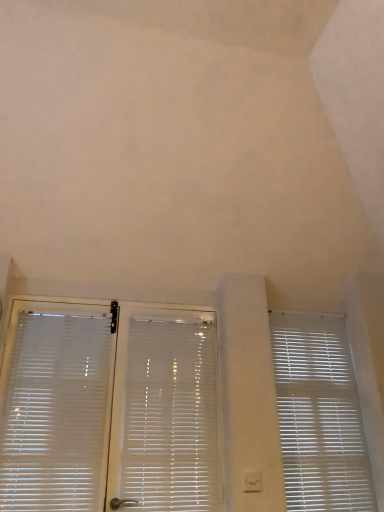
The width and height of the screenshot is (384, 512). Describe the element at coordinates (56, 407) in the screenshot. I see `white translucent blinds at left, placed as the 3th window blind when sorted from right to left` at that location.

What is the approximate height of white translucent blinds at left, placed as the 3th window blind when sorted from right to left?

white translucent blinds at left, placed as the 3th window blind when sorted from right to left, is 99.46 centimeters in height.

You are a GUI agent. You are given a task and a screenshot of the screen. Output one action in this format:
    pyautogui.click(x=<x>, y=<y>)
    Task: Click on the white plastic blinds at center, which appears as the second window blind when viewed from the left
    
    Given the screenshot: What is the action you would take?
    pyautogui.click(x=171, y=417)

Where is `white translucent blinds at left, placed as the 3th window blind when sorted from right to left`? The image size is (384, 512). white translucent blinds at left, placed as the 3th window blind when sorted from right to left is located at coordinates (56, 407).

Considering the positions of objects white plastic blinds at center, which appears as the second window blind when viewed from the left, and white plastic window blind at right, the first window blind from the right, in the image provided, who is more to the left, white plastic blinds at center, which appears as the second window blind when viewed from the left, or white plastic window blind at right, the first window blind from the right,?

white plastic blinds at center, which appears as the second window blind when viewed from the left, is more to the left.

How distant is white plastic blinds at center, which is the second window blind in right-to-left order, from white plastic window blind at right, the third window blind in the left-to-right sequence?

white plastic blinds at center, which is the second window blind in right-to-left order, is 24.55 inches away from white plastic window blind at right, the third window blind in the left-to-right sequence.

From the picture: How different are the orientations of white plastic blinds at center, which is the second window blind in right-to-left order, and white plastic window blind at right, the third window blind in the left-to-right sequence, in degrees?

white plastic blinds at center, which is the second window blind in right-to-left order, and white plastic window blind at right, the third window blind in the left-to-right sequence, are facing 1.87 degrees away from each other.

Does point (163, 426) lie in front of point (74, 317)?

Yes.

From the image's perspective, is white plastic blinds at center, which is the second window blind in right-to-left order, positioned above or below white translucent blinds at left, placed as the 3th window blind when sorted from right to left?

white plastic blinds at center, which is the second window blind in right-to-left order, is below white translucent blinds at left, placed as the 3th window blind when sorted from right to left.

Is white plastic blinds at center, which is the second window blind in right-to-left order, positioned far away from white translucent blinds at left, placed as the 1th window blind when sorted from left to right?

white plastic blinds at center, which is the second window blind in right-to-left order, is near white translucent blinds at left, placed as the 1th window blind when sorted from left to right, not far away.

Is white plastic blinds at center, which appears as the second window blind when viewed from the left, inside or outside of white translucent blinds at left, placed as the 3th window blind when sorted from right to left?

white plastic blinds at center, which appears as the second window blind when viewed from the left, is located beyond the bounds of white translucent blinds at left, placed as the 3th window blind when sorted from right to left.

Which point is more forward, (294, 331) or (158, 368)?

The point (158, 368) is closer to the camera.

Is white plastic window blind at right, the first window blind from the right, beside white plastic blinds at center, which appears as the second window blind when viewed from the left?

They are not placed beside each other.

Is white plastic window blind at right, the third window blind in the left-to-right sequence, at the left side of white plastic blinds at center, which is the second window blind in right-to-left order?

No.

Does white plastic window blind at right, the first window blind from the right, have a lesser width compared to white plastic blinds at center, which appears as the second window blind when viewed from the left?

Correct, the width of white plastic window blind at right, the first window blind from the right, is less than that of white plastic blinds at center, which appears as the second window blind when viewed from the left.

From a real-world perspective, is white plastic window blind at right, the third window blind in the left-to-right sequence, located beneath white translucent blinds at left, placed as the 3th window blind when sorted from right to left?

Actually, white plastic window blind at right, the third window blind in the left-to-right sequence, is physically above white translucent blinds at left, placed as the 3th window blind when sorted from right to left, in the real world.

Consider the image. Is white plastic window blind at right, the first window blind from the right, positioned beyond the bounds of white translucent blinds at left, placed as the 3th window blind when sorted from right to left?

Indeed, white plastic window blind at right, the first window blind from the right, is completely outside white translucent blinds at left, placed as the 3th window blind when sorted from right to left.

From the image's perspective, which one is positioned higher, white plastic window blind at right, the first window blind from the right, or white translucent blinds at left, placed as the 1th window blind when sorted from left to right?

white translucent blinds at left, placed as the 1th window blind when sorted from left to right.

Is white translucent blinds at left, placed as the 3th window blind when sorted from right to left, spatially inside white plastic blinds at center, which appears as the second window blind when viewed from the left, or outside of it?

white translucent blinds at left, placed as the 3th window blind when sorted from right to left, exists outside the volume of white plastic blinds at center, which appears as the second window blind when viewed from the left.

From a real-world perspective, between white translucent blinds at left, placed as the 1th window blind when sorted from left to right, and white plastic blinds at center, which appears as the second window blind when viewed from the left, who is vertically lower?

From a 3D spatial view, white plastic blinds at center, which appears as the second window blind when viewed from the left, is below.

How many degrees apart are the facing directions of white translucent blinds at left, placed as the 1th window blind when sorted from left to right, and white plastic blinds at center, which appears as the second window blind when viewed from the left?

0.00102 degrees.

Does white translucent blinds at left, placed as the 1th window blind when sorted from left to right, come behind white plastic blinds at center, which appears as the second window blind when viewed from the left?

No, it is not.

Choose the correct answer: Is white translucent blinds at left, placed as the 1th window blind when sorted from left to right, inside white plastic window blind at right, the third window blind in the left-to-right sequence, or outside it?

white translucent blinds at left, placed as the 1th window blind when sorted from left to right, cannot be found inside white plastic window blind at right, the third window blind in the left-to-right sequence.

Based on the photo, from the image's perspective, does white translucent blinds at left, placed as the 3th window blind when sorted from right to left, appear lower than white plastic window blind at right, the first window blind from the right?

Actually, white translucent blinds at left, placed as the 3th window blind when sorted from right to left, appears above white plastic window blind at right, the first window blind from the right, in the image.

Is white translucent blinds at left, placed as the 3th window blind when sorted from right to left, with white plastic window blind at right, the third window blind in the left-to-right sequence?

white translucent blinds at left, placed as the 3th window blind when sorted from right to left, and white plastic window blind at right, the third window blind in the left-to-right sequence, are clearly separated.

Where is `window blind on the right of white plastic blinds at center, which is the second window blind in right-to-left order`? This screenshot has height=512, width=384. window blind on the right of white plastic blinds at center, which is the second window blind in right-to-left order is located at coordinates (319, 415).

Which window blind is the 1st one when counting from the back of the white translucent blinds at left, placed as the 3th window blind when sorted from right to left? Please provide its 2D coordinates.

[(171, 417)]

Which object lies nearer to the anchor point white translucent blinds at left, placed as the 3th window blind when sorted from right to left, white plastic window blind at right, the first window blind from the right, or white plastic blinds at center, which is the second window blind in right-to-left order?

Based on the image, white plastic blinds at center, which is the second window blind in right-to-left order, appears to be nearer to white translucent blinds at left, placed as the 3th window blind when sorted from right to left.

Estimate the real-world distances between objects in this image. Which object is further from white plastic window blind at right, the first window blind from the right, white translucent blinds at left, placed as the 1th window blind when sorted from left to right, or white plastic blinds at center, which is the second window blind in right-to-left order?

Among the two, white translucent blinds at left, placed as the 1th window blind when sorted from left to right, is located further to white plastic window blind at right, the first window blind from the right.

In the scene shown: Based on their spatial positions, is white plastic blinds at center, which appears as the second window blind when viewed from the left, or white translucent blinds at left, placed as the 3th window blind when sorted from right to left, closer to white plastic window blind at right, the first window blind from the right?

white plastic blinds at center, which appears as the second window blind when viewed from the left, lies closer to white plastic window blind at right, the first window blind from the right, than the other object.

When comparing their distances from white plastic blinds at center, which appears as the second window blind when viewed from the left, does white translucent blinds at left, placed as the 1th window blind when sorted from left to right, or white plastic window blind at right, the first window blind from the right, seem further?

white plastic window blind at right, the first window blind from the right, is positioned further to the anchor white plastic blinds at center, which appears as the second window blind when viewed from the left.

Estimate the real-world distances between objects in this image. Which object is closer to white plastic blinds at center, which appears as the second window blind when viewed from the left, white plastic window blind at right, the first window blind from the right, or white translucent blinds at left, placed as the 3th window blind when sorted from right to left?

white translucent blinds at left, placed as the 3th window blind when sorted from right to left, lies closer to white plastic blinds at center, which appears as the second window blind when viewed from the left, than the other object.

Consider the image. Based on their spatial positions, is white plastic blinds at center, which is the second window blind in right-to-left order, or white plastic window blind at right, the third window blind in the left-to-right sequence, further from white translucent blinds at left, placed as the 3th window blind when sorted from right to left?

Based on the image, white plastic window blind at right, the third window blind in the left-to-right sequence, appears to be further to white translucent blinds at left, placed as the 3th window blind when sorted from right to left.

Where is `window blind between white translucent blinds at left, placed as the 1th window blind when sorted from left to right, and white plastic window blind at right, the first window blind from the right`? window blind between white translucent blinds at left, placed as the 1th window blind when sorted from left to right, and white plastic window blind at right, the first window blind from the right is located at coordinates (171, 417).